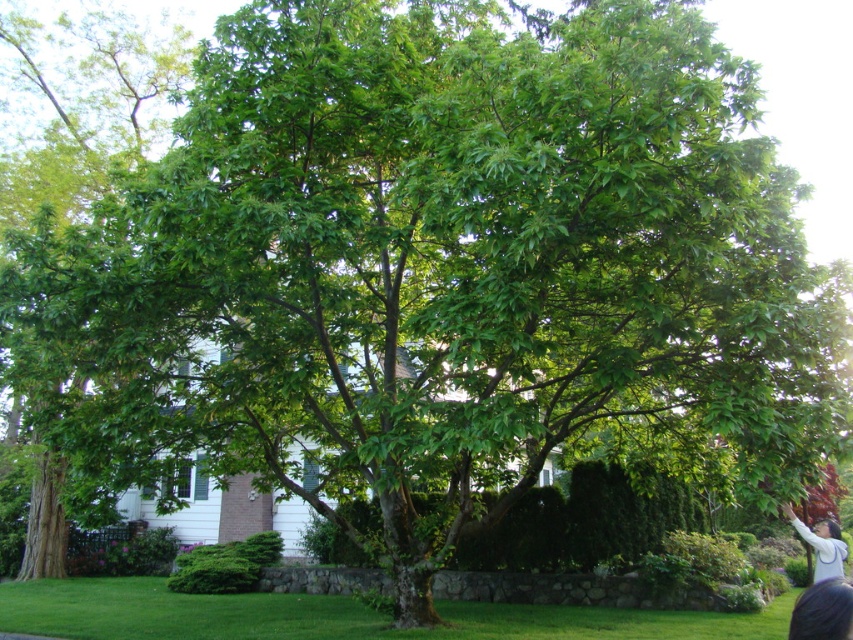
Question: Can you confirm if green grass at lower center is thinner than dark brown hair at lower right?

Choices:
 (A) no
 (B) yes

Answer: (A)

Question: Considering the real-world distances, which object is closest to the dark brown hair at lower right?

Choices:
 (A) light gray sweater at lower right
 (B) green grass at lower center

Answer: (A)

Question: Which point is closer to the camera?

Choices:
 (A) green grass at lower center
 (B) dark brown hair at lower right

Answer: (B)

Question: From the image, what is the correct spatial relationship of green grass at lower center in relation to dark brown hair at lower right?

Choices:
 (A) left
 (B) right

Answer: (A)

Question: Where is green grass at lower center located in relation to light gray sweater at lower right in the image?

Choices:
 (A) above
 (B) below

Answer: (B)

Question: Estimate the real-world distances between objects in this image. Which object is closer to the light gray sweater at lower right?

Choices:
 (A) dark brown hair at lower right
 (B) green grass at lower center

Answer: (A)